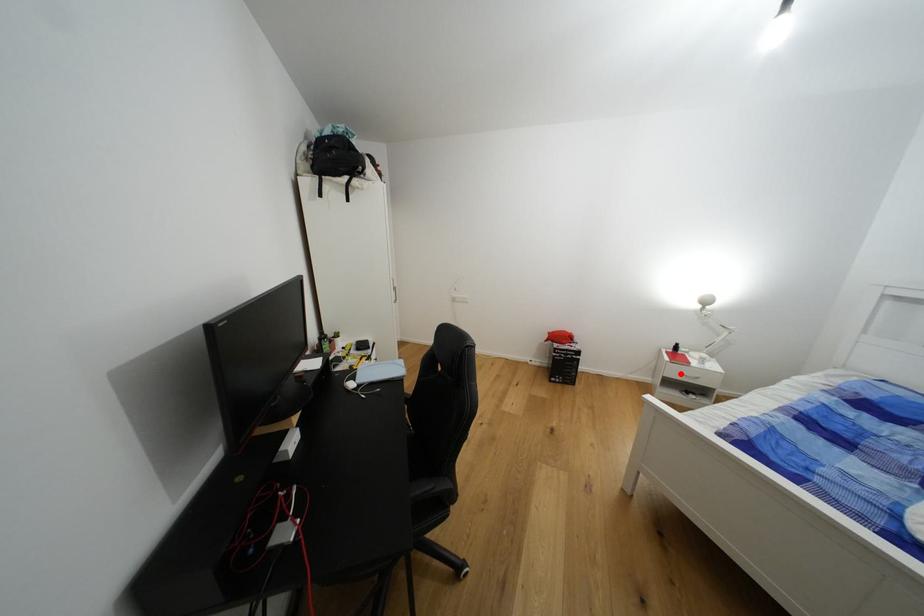
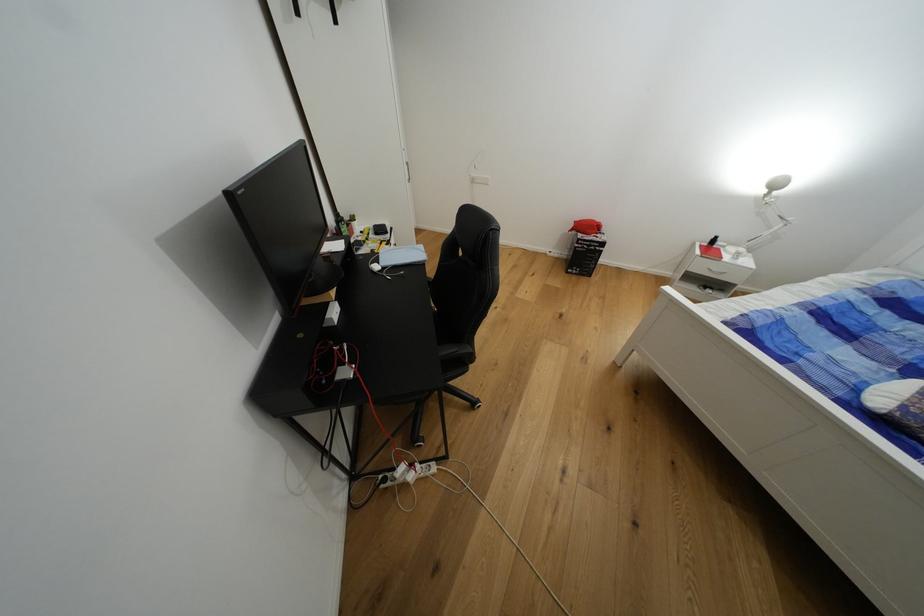
The point at the highlighted location is marked in the first image. Where is the corresponding point in the second image?

(707, 268)